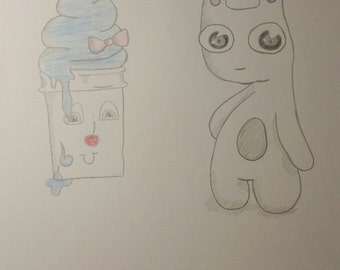
Where is `cup`? This screenshot has height=270, width=340. cup is located at coordinates (116, 167).